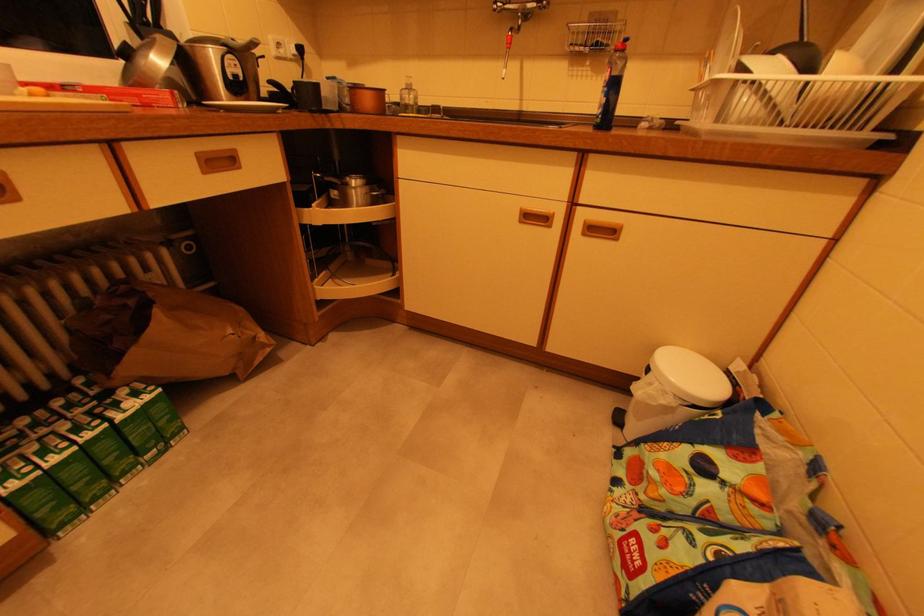
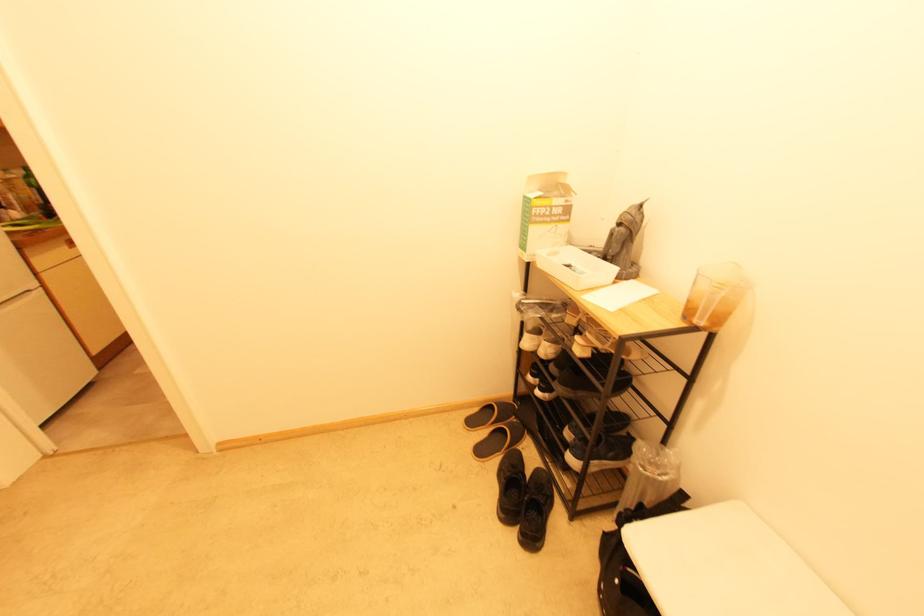
Question: I am providing you with two images of the same scene from different viewpoints. After the viewpoint changes to image2, which objects are now occluded?

Choices:
 (A) white shoe
 (B) brown paper bag
 (C) black sneaker
 (D) silver thermostat dial

Answer: (B)